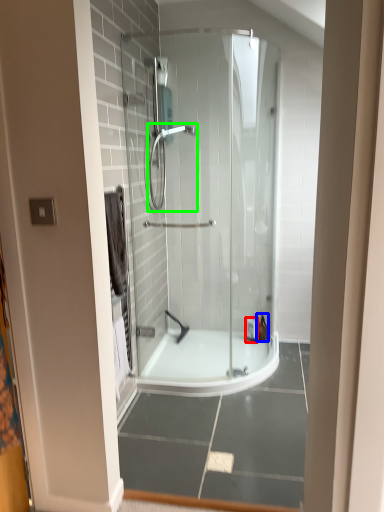
Question: Considering the real-world distances, which object is farthest from toiletry (highlighted by a red box)? toiletry (highlighted by a blue box) or shower (highlighted by a green box)?

Choices:
 (A) toiletry
 (B) shower

Answer: (B)